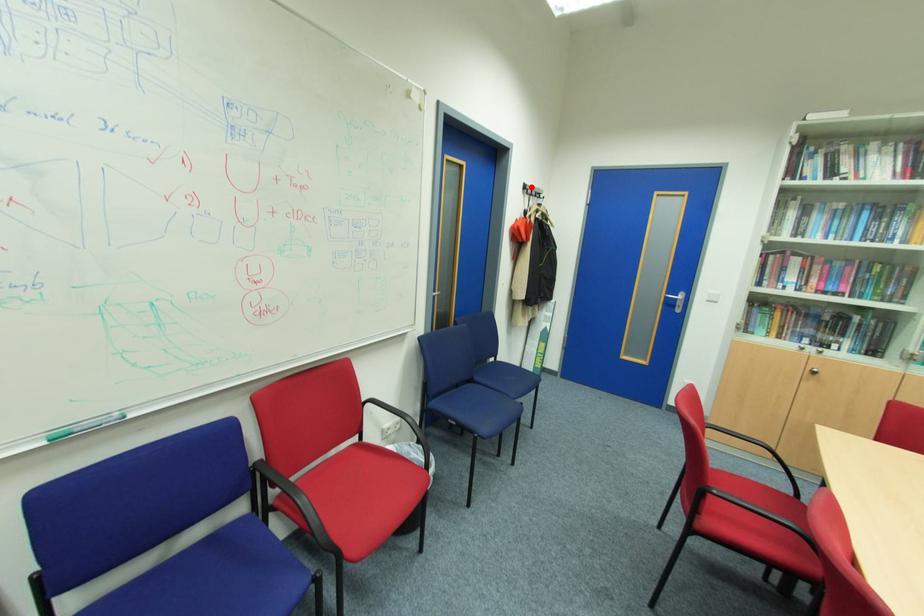
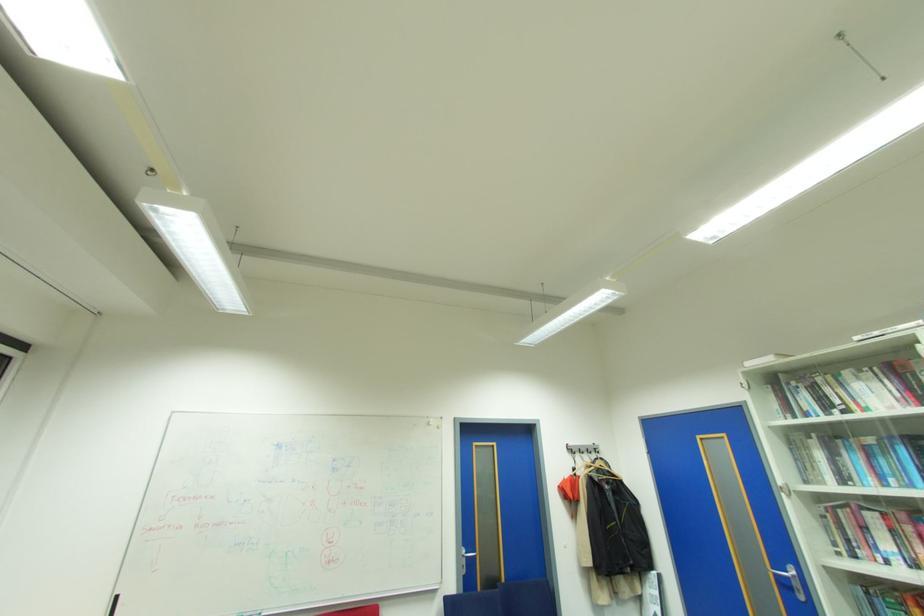
Locate, in the second image, the point that corresponds to the highlighted location in the first image.

(573, 448)